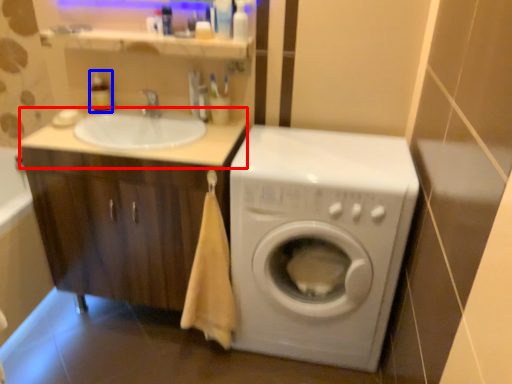
Question: Among these objects, which one is nearest to the camera, counter top (highlighted by a red box) or toiletry (highlighted by a blue box)?

Choices:
 (A) counter top
 (B) toiletry

Answer: (A)